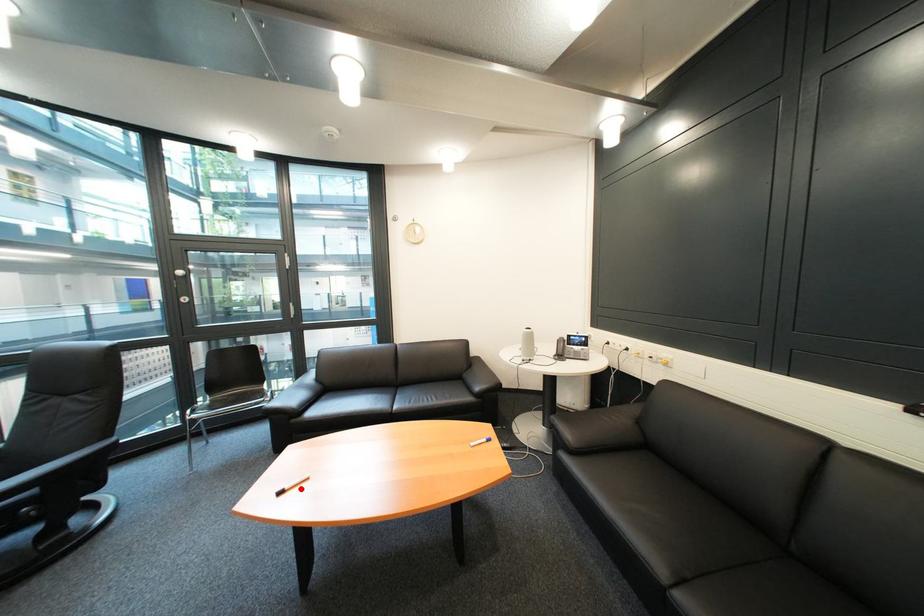
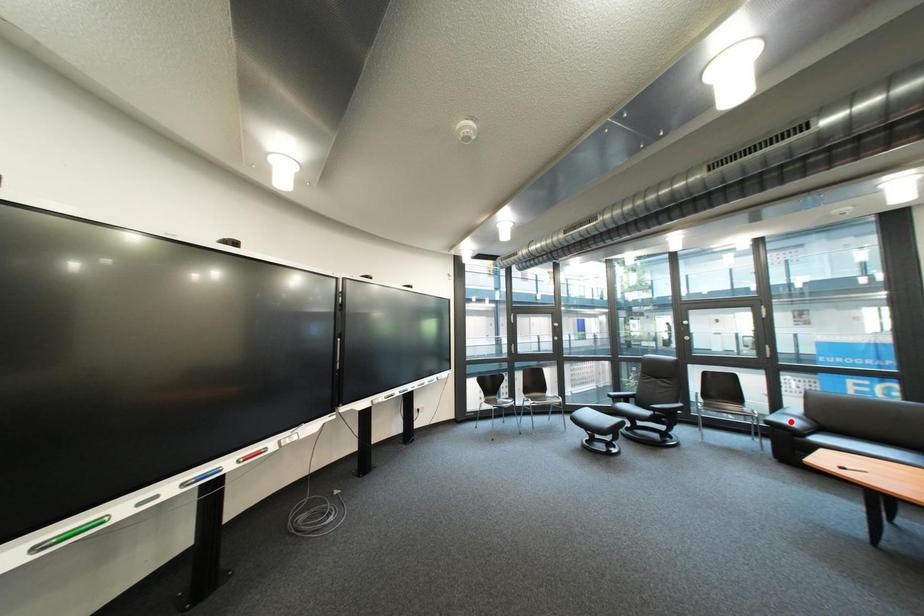
I am providing you with two images of the same scene from different viewpoints. A red point is marked on the first image and another point is marked on the second image. Is the red point in image1 aligned with the point shown in image2?

No